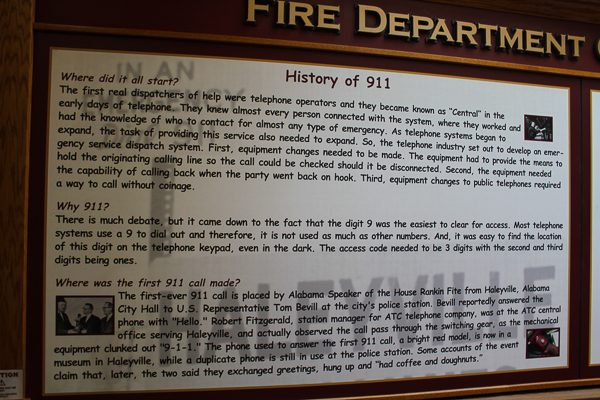
The height and width of the screenshot is (400, 600). Find the location of `small photos`. small photos is located at coordinates (545, 131), (552, 349), (80, 322).